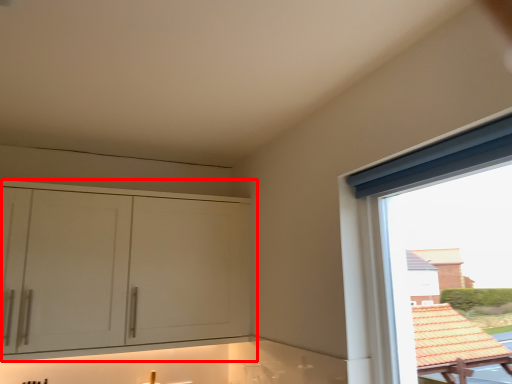
Question: From the image's perspective, considering the relative positions of cabinetry (annotated by the red box) and window in the image provided, where is cabinetry (annotated by the red box) located with respect to the staircase?

Choices:
 (A) above
 (B) below

Answer: (B)